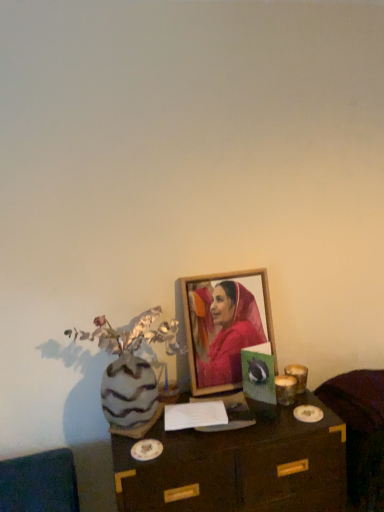
The image size is (384, 512). I want to click on wooden picture frame at center, so point(224,326).

At what (x,y) coordinates should I click in order to perform the action: click on velvet dark brown armchair at lower right. Please return your answer as a coordinate pair (x, y). The image size is (384, 512). Looking at the image, I should click on (360, 433).

The height and width of the screenshot is (512, 384). What do you see at coordinates (360, 433) in the screenshot? I see `velvet dark brown armchair at lower right` at bounding box center [360, 433].

Identify the location of wooden picture frame at center. The image size is (384, 512). (224, 326).

Which object is further away from the camera, wooden table at center or wooden picture frame at center?

wooden picture frame at center is further away from the camera.

Which point is more distant from viewer, (317, 445) or (211, 392)?

The point (211, 392) is farther from the camera.

Is wooden table at center turned away from wooden picture frame at center?

wooden table at center is not turned away from wooden picture frame at center.

From a real-world perspective, which object stands above the other?

wooden picture frame at center.

Is point (229, 315) less distant than point (372, 408)?

No, (229, 315) is behind (372, 408).

Which of these two, wooden picture frame at center or velvet dark brown armchair at lower right, is wider?

Wider between the two is velvet dark brown armchair at lower right.

Would you say wooden table at center contains velvet dark brown armchair at lower right?

No.

Which is more to the right, wooden table at center or velvet dark brown armchair at lower right?

Positioned to the right is velvet dark brown armchair at lower right.

From the image's perspective, is wooden table at center over velvet dark brown armchair at lower right?

No.

Is wooden table at center oriented towards velvet dark brown armchair at lower right?

No.

Considering the relative positions of velvet dark brown armchair at lower right and wooden table at center in the image provided, is velvet dark brown armchair at lower right to the left or to the right of wooden table at center?

From the image, it's evident that velvet dark brown armchair at lower right is to the right of wooden table at center.

From a real-world perspective, who is located higher, velvet dark brown armchair at lower right or wooden table at center?

From a 3D spatial view, velvet dark brown armchair at lower right is above.

Would you say velvet dark brown armchair at lower right contains wooden table at center?

No, wooden table at center is not a part of velvet dark brown armchair at lower right.

Which object is closer to the camera taking this photo, velvet dark brown armchair at lower right or wooden table at center?

Positioned in front is wooden table at center.

Between point (354, 481) and point (198, 280), which one is positioned in front?

The point (354, 481) is in front.

Does velvet dark brown armchair at lower right contain wooden picture frame at center?

Actually, wooden picture frame at center is outside velvet dark brown armchair at lower right.

Considering the sizes of objects velvet dark brown armchair at lower right and wooden picture frame at center in the image provided, who is taller, velvet dark brown armchair at lower right or wooden picture frame at center?

wooden picture frame at center is taller.

Looking at their sizes, would you say wooden picture frame at center is wider or thinner than wooden table at center?

Considering their sizes, wooden picture frame at center looks slimmer than wooden table at center.

From a real-world perspective, which is physically above, wooden picture frame at center or wooden table at center?

wooden picture frame at center, from a real-world perspective.

Is the depth of wooden picture frame at center greater than that of wooden table at center?

Yes, wooden picture frame at center is further from the viewer.

How different are the orientations of wooden picture frame at center and wooden table at center in degrees?

The angle between the facing direction of wooden picture frame at center and the facing direction of wooden table at center is 0.301 degrees.

At what (x,y) coordinates should I click in order to perform the action: click on picture frame that is on the right side of wooden table at center. Please return your answer as a coordinate pair (x, y). Looking at the image, I should click on (224, 326).

The height and width of the screenshot is (512, 384). What are the coordinates of `picture frame that appears on the left of velvet dark brown armchair at lower right` in the screenshot? It's located at (224, 326).

Estimate the real-world distances between objects in this image. Which object is further from wooden picture frame at center, wooden table at center or velvet dark brown armchair at lower right?

velvet dark brown armchair at lower right.

From the image, which object appears to be farther from wooden table at center, wooden picture frame at center or velvet dark brown armchair at lower right?

wooden picture frame at center lies further to wooden table at center than the other object.

Which object lies further to the anchor point wooden picture frame at center, velvet dark brown armchair at lower right or wooden table at center?

velvet dark brown armchair at lower right lies further to wooden picture frame at center than the other object.

In the scene shown: From the image, which object appears to be nearer to velvet dark brown armchair at lower right, wooden table at center or wooden picture frame at center?

wooden table at center is positioned closer to the anchor velvet dark brown armchair at lower right.

Which object lies nearer to the anchor point wooden table at center, velvet dark brown armchair at lower right or wooden picture frame at center?

velvet dark brown armchair at lower right.

In the scene shown: Based on their spatial positions, is wooden picture frame at center or wooden table at center further from velvet dark brown armchair at lower right?

The object further to velvet dark brown armchair at lower right is wooden picture frame at center.

Find the location of a particular element. The height and width of the screenshot is (512, 384). picture frame located between wooden table at center and velvet dark brown armchair at lower right in the left-right direction is located at coordinates (224, 326).